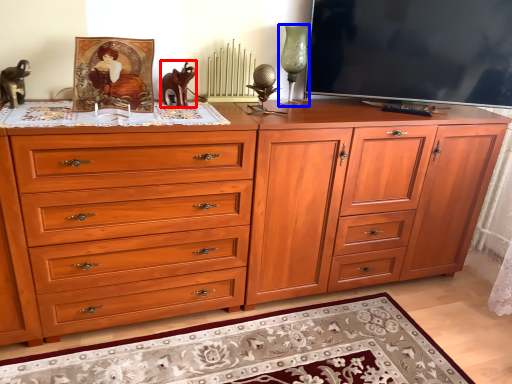
Question: Among these objects, which one is farthest to the camera, animal (highlighted by a red box) or candle holder (highlighted by a blue box)?

Choices:
 (A) animal
 (B) candle holder

Answer: (B)